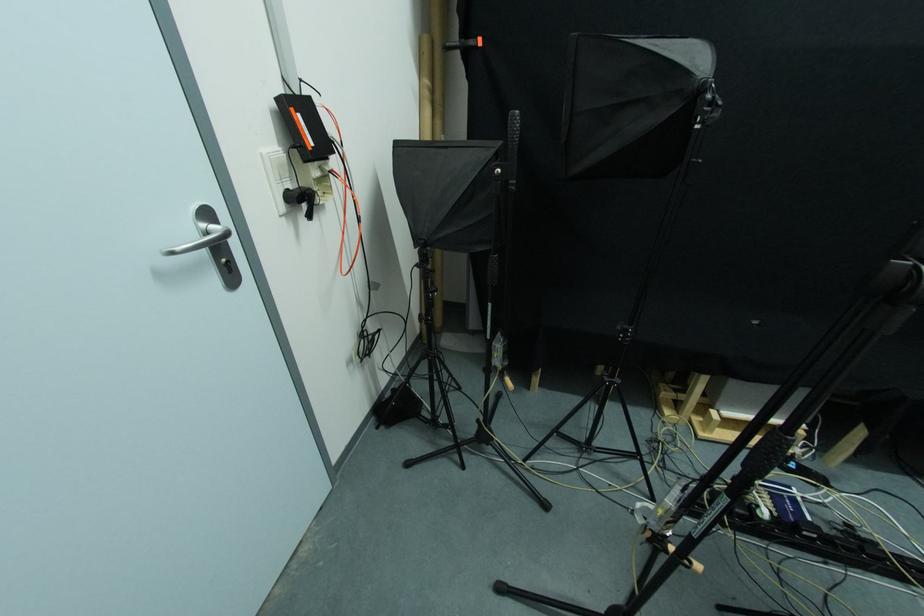
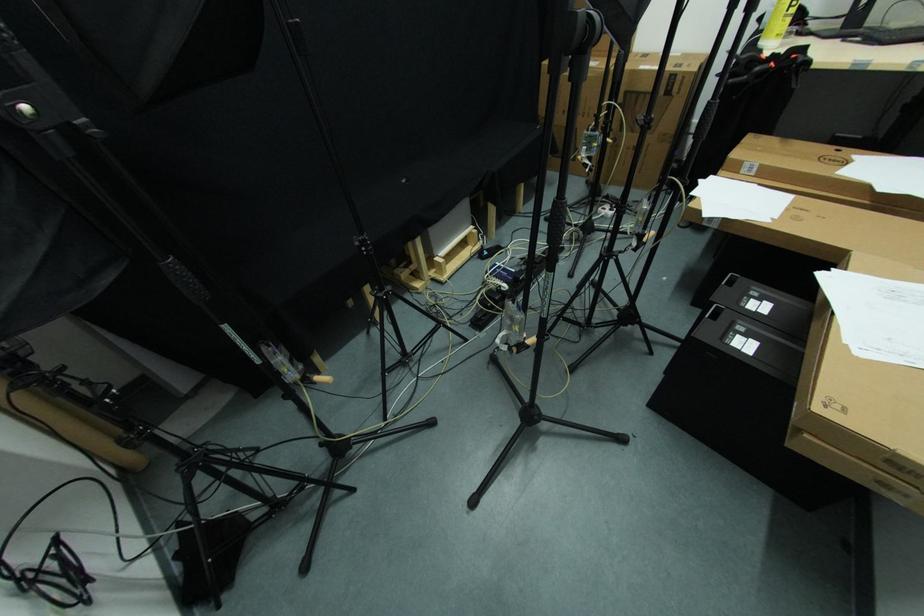
The images are taken continuously from a first-person perspective. In which direction is your viewpoint rotating?

The camera's rotation is toward right-down.